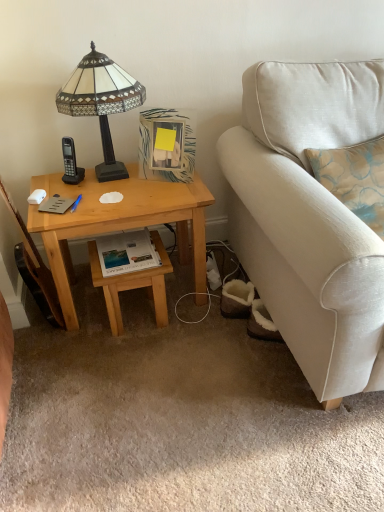
Image resolution: width=384 pixels, height=512 pixels. In order to click on empty space that is ontop of light wood desk at left (from a real-world perspective) in this screenshot , I will do `click(112, 184)`.